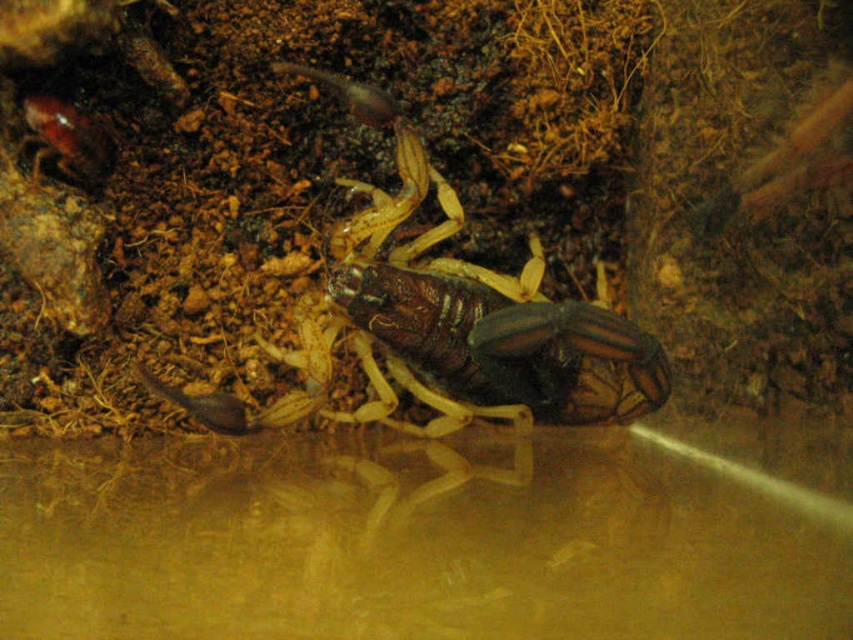
Question: Among these objects, which one is nearest to the camera?

Choices:
 (A) shiny brown beetle at upper left
 (B) brown shiny scorpion at center

Answer: (B)

Question: Can you confirm if brown shiny scorpion at center is thinner than shiny brown beetle at upper left?

Choices:
 (A) yes
 (B) no

Answer: (B)

Question: Is brown shiny scorpion at center bigger than shiny brown beetle at upper left?

Choices:
 (A) yes
 (B) no

Answer: (A)

Question: Among these points, which one is nearest to the camera?

Choices:
 (A) 361,250
 (B) 33,115

Answer: (B)

Question: Is brown shiny scorpion at center to the right of shiny brown beetle at upper left from the viewer's perspective?

Choices:
 (A) yes
 (B) no

Answer: (A)